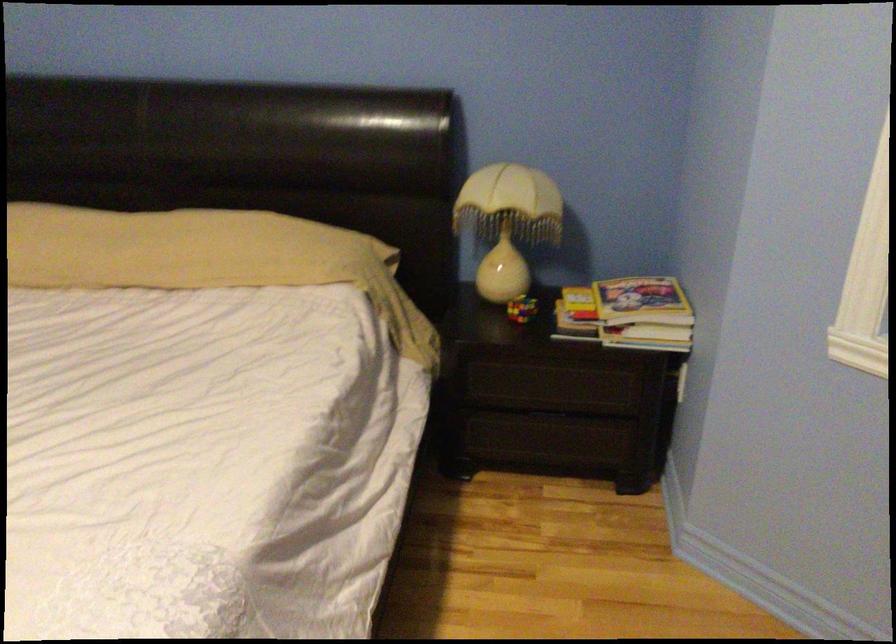
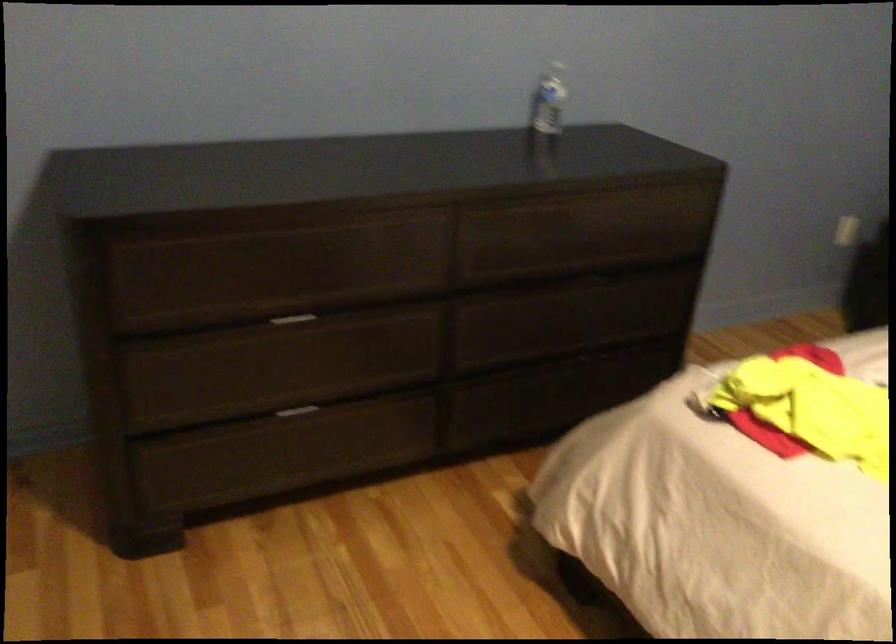
Question: The camera is either moving clockwise (left) or counter-clockwise (right) around the object. The first image is from the beginning of the video and the second image is from the end. Is the camera moving left or right when shooting the video?

Choices:
 (A) Left
 (B) Right

Answer: (B)